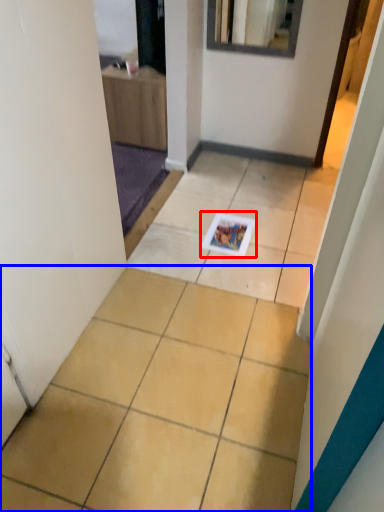
Question: Which of the following is the closest to the observer, magazine (highlighted by a red box) or ceramic tile (highlighted by a blue box)?

Choices:
 (A) magazine
 (B) ceramic tile

Answer: (B)